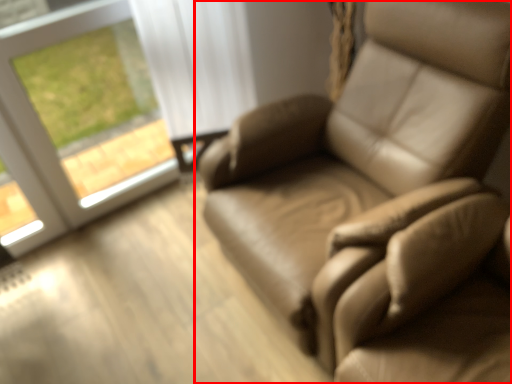
Question: From the image, what is the correct spatial relationship of chair (annotated by the red box) in relation to window?

Choices:
 (A) left
 (B) right

Answer: (B)